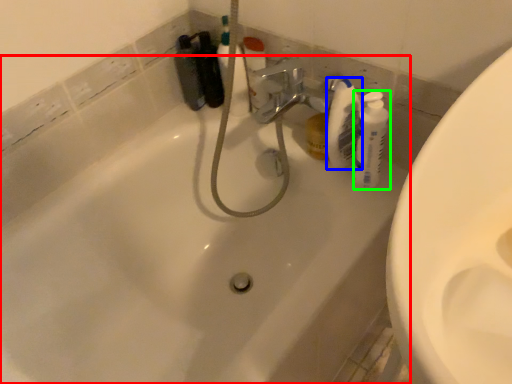
Question: Based on their relative distances, which object is farther from bathtub (highlighted by a red box)? Choose from cleaning product (highlighted by a blue box) and cleaning product (highlighted by a green box).

Choices:
 (A) cleaning product
 (B) cleaning product

Answer: (B)